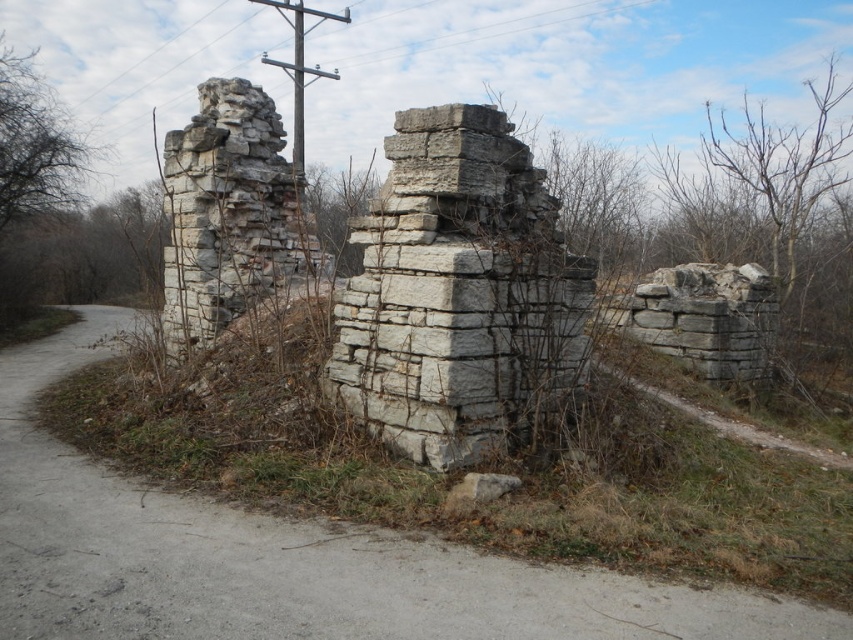
You are a photographer planning to take a picture of the white stone ruins at left and the gray stone telegraph pole at upper center. Which object will appear closer to the bottom of the photo?

The white stone ruins at left will appear closer to the bottom of the photo because it is positioned under the gray stone telegraph pole at upper center.

You are a construction worker assessing the site. You need to determine which structure, the gray stone wall at center or the white stone ruins at left, requires more reinforcement based on their widths. Which one do you recommend?

The gray stone wall at center might be wider than white stone ruins at left, so it may require more reinforcement due to its larger width.

You are a photographer planning to take a picture of the gray stone wall at center and the gray stone telegraph pole at upper center. Based on their positions, will the telegraph pole block the view of the wall in your photo?

The gray stone wall at center is positioned under the gray stone telegraph pole at upper center, so the telegraph pole will block the view of the wall in the photo.